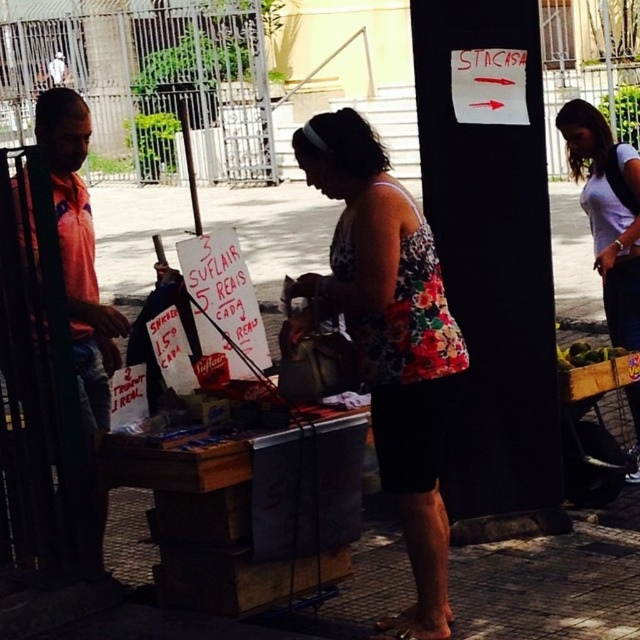
Question: Considering the real-world distances, which object is closest to the white cotton shirt at right?

Choices:
 (A) green leafy vegetables at lower right
 (B) orange fabric shirt at left
 (C) floral fabric dress at center

Answer: (A)

Question: Which of the following is the closest to the observer?

Choices:
 (A) green leafy vegetables at lower right
 (B) orange fabric shirt at left
 (C) white cotton shirt at right

Answer: (B)

Question: Which point is closer to the camera?

Choices:
 (A) (624, 355)
 (B) (396, 412)

Answer: (B)

Question: Can you confirm if floral fabric dress at center is positioned to the right of green leafy vegetables at lower right?

Choices:
 (A) yes
 (B) no

Answer: (B)

Question: Can you confirm if floral fabric dress at center is positioned below white cotton shirt at right?

Choices:
 (A) yes
 (B) no

Answer: (A)

Question: Is orange fabric shirt at left above white cotton shirt at right?

Choices:
 (A) yes
 (B) no

Answer: (B)